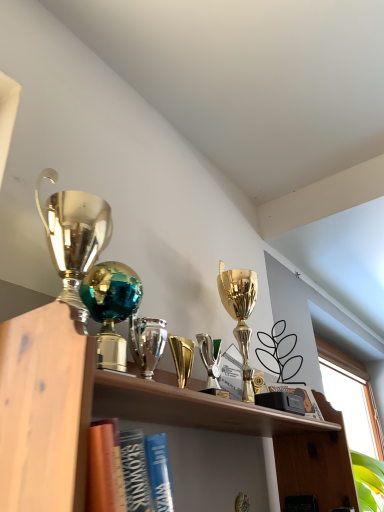
Question: Considering the relative sizes of shiny teal glass globe at center, the 1th trophy viewed from the left, and black matte book at center in the image provided, is shiny teal glass globe at center, the 1th trophy viewed from the left, thinner than black matte book at center?

Choices:
 (A) no
 (B) yes

Answer: (A)

Question: Would you consider shiny teal glass globe at center, the 1th trophy viewed from the left, to be distant from black matte book at center?

Choices:
 (A) no
 (B) yes

Answer: (A)

Question: Is shiny teal glass globe at center, which is counted as the 2th trophy, starting from the right, closer to camera compared to black matte book at center?

Choices:
 (A) yes
 (B) no

Answer: (A)

Question: Is shiny teal glass globe at center, which is counted as the 2th trophy, starting from the right, further to the viewer compared to black matte book at center?

Choices:
 (A) no
 (B) yes

Answer: (A)

Question: Is shiny teal glass globe at center, which is counted as the 2th trophy, starting from the right, at the left side of black matte book at center?

Choices:
 (A) no
 (B) yes

Answer: (B)

Question: From the image's perspective, is shiny teal glass globe at center, which is counted as the 2th trophy, starting from the right, beneath black matte book at center?

Choices:
 (A) no
 (B) yes

Answer: (A)

Question: Can you confirm if shiny silver trophy at center, which ranks as the first trophy in right-to-left order, is positioned to the right of shiny teal glass globe at center, the 1th trophy viewed from the left?

Choices:
 (A) no
 (B) yes

Answer: (B)

Question: Is shiny silver trophy at center, the 2th trophy positioned from the left, not inside shiny teal glass globe at center, the 1th trophy viewed from the left?

Choices:
 (A) no
 (B) yes

Answer: (B)

Question: Is shiny silver trophy at center, which ranks as the first trophy in right-to-left order, facing towards shiny teal glass globe at center, which is counted as the 2th trophy, starting from the right?

Choices:
 (A) yes
 (B) no

Answer: (B)

Question: Does shiny silver trophy at center, which ranks as the first trophy in right-to-left order, have a lesser height compared to shiny teal glass globe at center, the 1th trophy viewed from the left?

Choices:
 (A) yes
 (B) no

Answer: (A)

Question: Is shiny silver trophy at center, which ranks as the first trophy in right-to-left order, facing away from shiny teal glass globe at center, which is counted as the 2th trophy, starting from the right?

Choices:
 (A) no
 (B) yes

Answer: (A)

Question: From the image's perspective, does shiny silver trophy at center, which ranks as the first trophy in right-to-left order, appear higher than shiny teal glass globe at center, which is counted as the 2th trophy, starting from the right?

Choices:
 (A) no
 (B) yes

Answer: (A)

Question: Is shiny teal glass globe at center, which is counted as the 2th trophy, starting from the right, positioned beyond the bounds of shiny silver trophy at center, which ranks as the first trophy in right-to-left order?

Choices:
 (A) yes
 (B) no

Answer: (A)